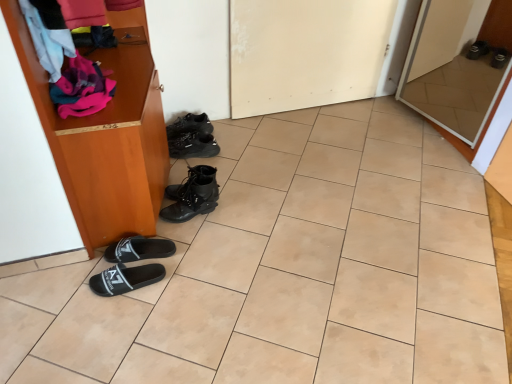
Where is `free space behind black fabric slipper at lower left, which ranks as the fourth footwear in back-to-front order`? This screenshot has width=512, height=384. free space behind black fabric slipper at lower left, which ranks as the fourth footwear in back-to-front order is located at coordinates (160, 233).